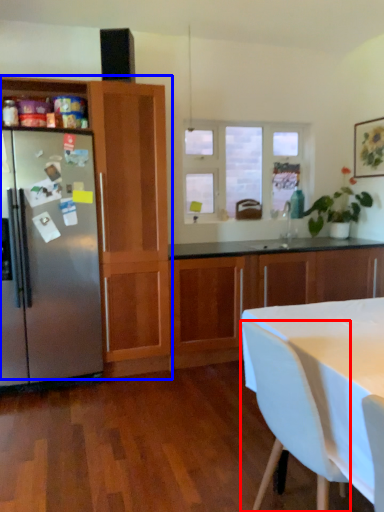
Question: Among these objects, which one is nearest to the camera, chair (highlighted by a red box) or cabinetry (highlighted by a blue box)?

Choices:
 (A) chair
 (B) cabinetry

Answer: (A)